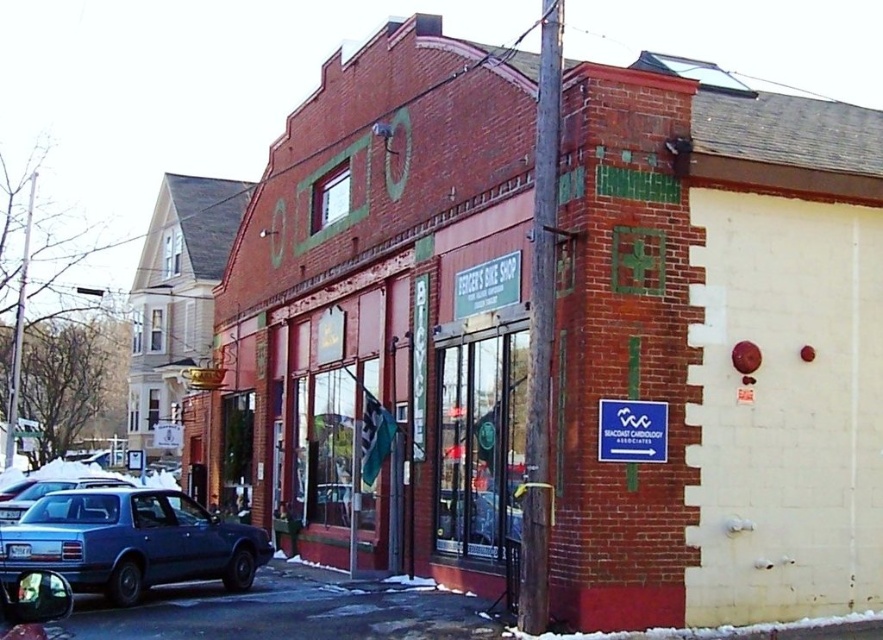
Question: Is matte blue sedan at lower left to the left of brown wooden pole at center from the viewer's perspective?

Choices:
 (A) no
 (B) yes

Answer: (B)

Question: Is blue plastic sign at center smaller than metallic blue sedan at lower left?

Choices:
 (A) yes
 (B) no

Answer: (A)

Question: Among these objects, which one is farthest from the camera?

Choices:
 (A) matte blue sedan at lower left
 (B) metallic blue sedan at lower left
 (C) brown wooden pole at center
 (D) metallic blue sedan at center

Answer: (B)

Question: Which object is positioned farthest from the matte blue sedan at lower left?

Choices:
 (A) brown wooden pole at center
 (B) metallic blue sedan at center

Answer: (A)

Question: Estimate the real-world distances between objects in this image. Which object is closer to the metallic blue sedan at center?

Choices:
 (A) blue plastic sign at center
 (B) metallic blue sedan at lower left

Answer: (A)

Question: Does matte blue sedan at lower left lie in front of metallic blue sedan at lower left?

Choices:
 (A) no
 (B) yes

Answer: (B)